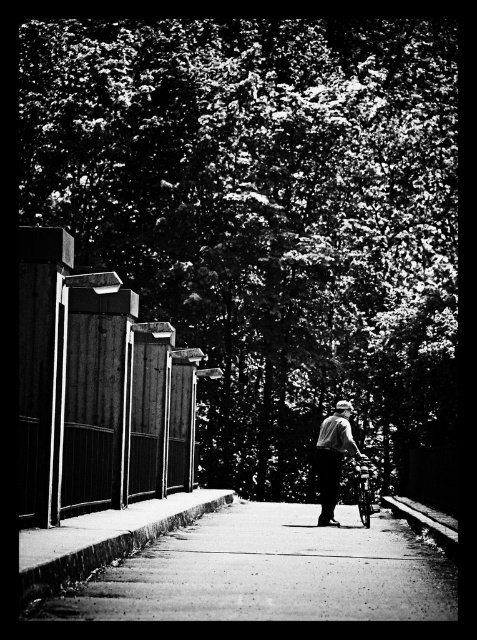
Who is shorter, dark green foliage at upper center or smooth concrete pavement at center?

Standing shorter between the two is smooth concrete pavement at center.

Is dark green foliage at upper center smaller than smooth concrete pavement at center?

No, dark green foliage at upper center is not smaller than smooth concrete pavement at center.

I want to click on dark green foliage at upper center, so click(266, 214).

Find the location of a particular element. dark green foliage at upper center is located at coordinates (266, 214).

Consider the image. Is dark green foliage at upper center wider than smooth gray shirt at center?

Yes, dark green foliage at upper center is wider than smooth gray shirt at center.

Find the location of a particular element. The width and height of the screenshot is (477, 640). dark green foliage at upper center is located at coordinates (266, 214).

Between point (301, 490) and point (346, 406), which one is positioned in front?

Positioned in front is point (346, 406).

Find the location of a particular element. dark green foliage at upper center is located at coordinates coord(266,214).

Who is more distant from viewer, (197,579) or (323,435)?

The point (323,435) is behind.

Between smooth concrete pavement at center and smooth gray shirt at center, which one is positioned lower?

Positioned lower is smooth concrete pavement at center.

The width and height of the screenshot is (477, 640). Describe the element at coordinates (271, 572) in the screenshot. I see `smooth concrete pavement at center` at that location.

Find the location of a particular element. smooth concrete pavement at center is located at coordinates (271, 572).